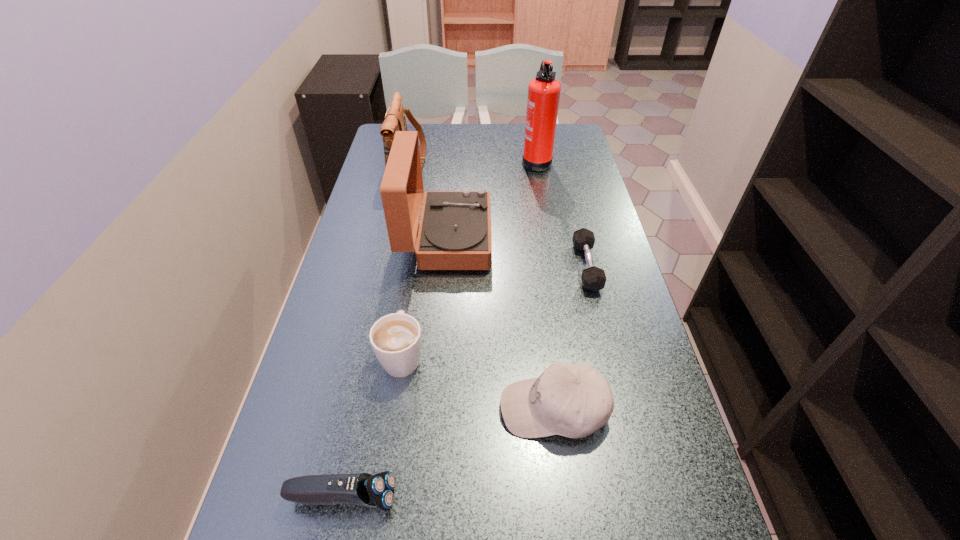
Where is `vacant area between the fire extinguisher and the third tallest object`? vacant area between the fire extinguisher and the third tallest object is located at coordinates (472, 160).

At what (x,y) coordinates should I click in order to perform the action: click on vacant space in between the baseball cap and the second tallest object. Please return your answer as a coordinate pair (x, y). Image resolution: width=960 pixels, height=540 pixels. Looking at the image, I should click on (500, 323).

This screenshot has width=960, height=540. I want to click on free space that is in between the fire extinguisher and the electric shaver, so click(x=440, y=329).

You are a GUI agent. You are given a task and a screenshot of the screen. Output one action in this format:
    pyautogui.click(x=<x>, y=<y>)
    Task: Click on the vacant space that's between the tallest object and the phonograph record
    The height and width of the screenshot is (540, 960).
    Given the screenshot: What is the action you would take?
    pyautogui.click(x=492, y=200)

This screenshot has height=540, width=960. In order to click on the fourth closest object to the cappuccino in this screenshot , I will do `click(593, 278)`.

In order to click on object that is the nearest to the fire extinguisher in this screenshot , I will do `click(454, 233)`.

Find the location of `free region that satisfies the following two spatial constraints: 1. with the handle on the side of the cappuccino; 2. on the left side of the shortest object`. free region that satisfies the following two spatial constraints: 1. with the handle on the side of the cappuccino; 2. on the left side of the shortest object is located at coordinates (416, 266).

Identify the location of vacant position in the image that satisfies the following two spatial constraints: 1. on the front-facing side of the shoulder bag; 2. on the back side of the dumbbell. The image size is (960, 540). (x=386, y=266).

Identify the location of vacant region that satisfies the following two spatial constraints: 1. on the back side of the rightmost object; 2. on the face of the phonograph record. This screenshot has height=540, width=960. (580, 239).

I want to click on free location that satisfies the following two spatial constraints: 1. on the front-facing side of the fifth shortest object; 2. on the right side of the rightmost object, so click(386, 266).